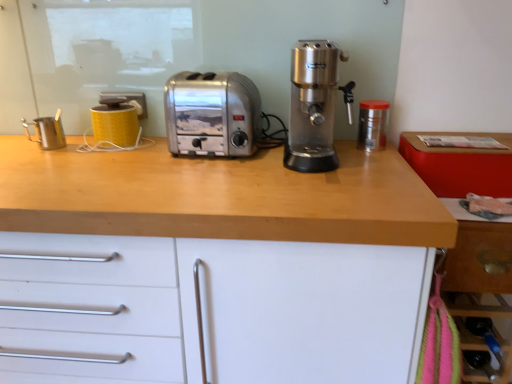
Describe the element at coordinates (212, 114) in the screenshot. I see `satin silver toaster at center` at that location.

What do you see at coordinates (209, 310) in the screenshot? I see `wooden countertop at center` at bounding box center [209, 310].

How much space does transparent plastic container at right, arranged as the 3th kitchen appliance when viewed from the left, occupy horizontally?

transparent plastic container at right, arranged as the 3th kitchen appliance when viewed from the left, is 4.26 inches in width.

Measure the distance between transparent plastic container at right, the 1th kitchen appliance in the right-to-left sequence, and camera.

transparent plastic container at right, the 1th kitchen appliance in the right-to-left sequence, and camera are 1.20 meters apart.

This screenshot has width=512, height=384. What do you see at coordinates (480, 259) in the screenshot?
I see `wooden drawer at lower right` at bounding box center [480, 259].

The width and height of the screenshot is (512, 384). I want to click on satin silver coffee machine at center, so click(x=314, y=106).

Could you measure the distance between satin silver toaster at center and transparent plastic container at right, arranged as the 3th kitchen appliance when viewed from the left?

satin silver toaster at center is 16.30 inches away from transparent plastic container at right, arranged as the 3th kitchen appliance when viewed from the left.

From a real-world perspective, is satin silver toaster at center physically above transparent plastic container at right, arranged as the 3th kitchen appliance when viewed from the left?

Yes, from a real-world perspective, satin silver toaster at center is on top of transparent plastic container at right, arranged as the 3th kitchen appliance when viewed from the left.

Is satin silver toaster at center positioned with its back to transparent plastic container at right, the 1th kitchen appliance in the right-to-left sequence?

No.

Can you confirm if satin silver toaster at center is thinner than transparent plastic container at right, arranged as the 3th kitchen appliance when viewed from the left?

No, satin silver toaster at center is not thinner than transparent plastic container at right, arranged as the 3th kitchen appliance when viewed from the left.

Which object is further away from the camera taking this photo, yellow matte mug at upper left, which is the 2th kitchen appliance in left-to-right order, or wooden countertop at center?

yellow matte mug at upper left, which is the 2th kitchen appliance in left-to-right order, is further away from the camera.

Is wooden countertop at center at the back of yellow matte mug at upper left, which is the 2th kitchen appliance in left-to-right order?

No, yellow matte mug at upper left, which is the 2th kitchen appliance in left-to-right order,'s orientation is not away from wooden countertop at center.

Who is taller, yellow matte mug at upper left, which ranks as the second kitchen appliance in right-to-left order, or wooden countertop at center?

With more height is wooden countertop at center.

From a real-world perspective, is yellow matte mug at upper left, which ranks as the second kitchen appliance in right-to-left order, above or below wooden countertop at center?

yellow matte mug at upper left, which ranks as the second kitchen appliance in right-to-left order, is situated higher than wooden countertop at center in the real world.

Is satin silver toaster at center to the left of yellow matte mug at upper left, which ranks as the second kitchen appliance in right-to-left order, from the viewer's perspective?

No.

Are satin silver toaster at center and yellow matte mug at upper left, which ranks as the second kitchen appliance in right-to-left order, making contact?

No, satin silver toaster at center is not beside yellow matte mug at upper left, which ranks as the second kitchen appliance in right-to-left order.

Is satin silver toaster at center in front of or behind yellow matte mug at upper left, which ranks as the second kitchen appliance in right-to-left order, in the image?

Clearly, satin silver toaster at center is in front of yellow matte mug at upper left, which ranks as the second kitchen appliance in right-to-left order.

In the scene shown: Between satin silver toaster at center and yellow matte mug at upper left, which ranks as the second kitchen appliance in right-to-left order, which one has larger size?

satin silver toaster at center is bigger.

Which is in front, yellow matte mug at upper left, which is the 2th kitchen appliance in left-to-right order, or transparent plastic container at right, arranged as the 3th kitchen appliance when viewed from the left?

transparent plastic container at right, arranged as the 3th kitchen appliance when viewed from the left, is more forward.

Between yellow matte mug at upper left, which is the 2th kitchen appliance in left-to-right order, and transparent plastic container at right, the 1th kitchen appliance in the right-to-left sequence, which one has larger width?

Wider between the two is yellow matte mug at upper left, which is the 2th kitchen appliance in left-to-right order.

From their relative heights in the image, would you say yellow matte mug at upper left, which is the 2th kitchen appliance in left-to-right order, is taller or shorter than transparent plastic container at right, the 1th kitchen appliance in the right-to-left sequence?

In the image, yellow matte mug at upper left, which is the 2th kitchen appliance in left-to-right order, appears to be taller than transparent plastic container at right, the 1th kitchen appliance in the right-to-left sequence.

Image resolution: width=512 pixels, height=384 pixels. In order to click on the 1st kitchen appliance below the yellow matte mug at upper left, which is the 2th kitchen appliance in left-to-right order (from a real-world perspective) in this screenshot , I will do `click(372, 125)`.

Does yellow matte mug at upper left, which is the 2th kitchen appliance in left-to-right order, appear on the left side of satin silver coffee machine at center?

Yes.

Which object is wider, yellow matte mug at upper left, which ranks as the second kitchen appliance in right-to-left order, or satin silver coffee machine at center?

With larger width is satin silver coffee machine at center.

Is yellow matte mug at upper left, which is the 2th kitchen appliance in left-to-right order, facing away from satin silver coffee machine at center?

No, yellow matte mug at upper left, which is the 2th kitchen appliance in left-to-right order,'s orientation is not away from satin silver coffee machine at center.

Is point (121, 145) positioned in front of point (291, 145)?

That is False.

Is wooden drawer at lower right facing away from transparent plastic container at right, arranged as the 3th kitchen appliance when viewed from the left?

That's not correct — wooden drawer at lower right is not looking away from transparent plastic container at right, arranged as the 3th kitchen appliance when viewed from the left.

Is wooden drawer at lower right in contact with transparent plastic container at right, arranged as the 3th kitchen appliance when viewed from the left?

No, wooden drawer at lower right is not making contact with transparent plastic container at right, arranged as the 3th kitchen appliance when viewed from the left.

From the image's perspective, would you say wooden drawer at lower right is shown under transparent plastic container at right, arranged as the 3th kitchen appliance when viewed from the left?

Indeed, from the image's perspective, wooden drawer at lower right is shown beneath transparent plastic container at right, arranged as the 3th kitchen appliance when viewed from the left.

Considering the sizes of objects wooden drawer at lower right and transparent plastic container at right, arranged as the 3th kitchen appliance when viewed from the left, in the image provided, who is wider, wooden drawer at lower right or transparent plastic container at right, arranged as the 3th kitchen appliance when viewed from the left,?

With larger width is wooden drawer at lower right.

Is metallic stainless steel pitcher at left, positioned as the third kitchen appliance in right-to-left order, smaller than wooden countertop at center?

Correct, metallic stainless steel pitcher at left, positioned as the third kitchen appliance in right-to-left order, occupies less space than wooden countertop at center.

From a real-world perspective, which is physically above, metallic stainless steel pitcher at left, which ranks as the first kitchen appliance in left-to-right order, or wooden countertop at center?

From a 3D spatial view, metallic stainless steel pitcher at left, which ranks as the first kitchen appliance in left-to-right order, is above.

From the image's perspective, between metallic stainless steel pitcher at left, positioned as the third kitchen appliance in right-to-left order, and wooden countertop at center, which one is located above?

metallic stainless steel pitcher at left, positioned as the third kitchen appliance in right-to-left order, appears higher in the image.

From the satin silver toaster at center, count 1st kitchen appliances backward and point to it. Please provide its 2D coordinates.

[(372, 125)]

Find the location of a particular element. cabinetry that appears below the yellow matte mug at upper left, which ranks as the second kitchen appliance in right-to-left order (from the image's perspective) is located at coordinates (209, 310).

Looking at the image, which one is located further to wooden countertop at center, wooden drawer at lower right or transparent plastic container at right, arranged as the 3th kitchen appliance when viewed from the left?

transparent plastic container at right, arranged as the 3th kitchen appliance when viewed from the left, lies further to wooden countertop at center than the other object.

Consider the image. When comparing their distances from yellow matte mug at upper left, which is the 2th kitchen appliance in left-to-right order, does satin silver toaster at center or wooden drawer at lower right seem closer?

satin silver toaster at center is closer to yellow matte mug at upper left, which is the 2th kitchen appliance in left-to-right order.

Looking at the image, which one is located closer to satin silver toaster at center, yellow matte mug at upper left, which ranks as the second kitchen appliance in right-to-left order, or wooden drawer at lower right?

Among the two, yellow matte mug at upper left, which ranks as the second kitchen appliance in right-to-left order, is located nearer to satin silver toaster at center.

Based on their spatial positions, is satin silver coffee machine at center or wooden countertop at center further from wooden drawer at lower right?

The object further to wooden drawer at lower right is wooden countertop at center.

When comparing their distances from satin silver toaster at center, does wooden drawer at lower right or satin silver coffee machine at center seem closer?

Among the two, satin silver coffee machine at center is located nearer to satin silver toaster at center.

Considering their positions, is satin silver toaster at center positioned closer to transparent plastic container at right, the 1th kitchen appliance in the right-to-left sequence, than metallic stainless steel pitcher at left, positioned as the third kitchen appliance in right-to-left order?

satin silver toaster at center is closer to transparent plastic container at right, the 1th kitchen appliance in the right-to-left sequence.

Based on their spatial positions, is metallic stainless steel pitcher at left, which ranks as the first kitchen appliance in left-to-right order, or satin silver coffee machine at center closer to satin silver toaster at center?

satin silver coffee machine at center lies closer to satin silver toaster at center than the other object.

From the image, which object appears to be nearer to satin silver toaster at center, wooden countertop at center or yellow matte mug at upper left, which ranks as the second kitchen appliance in right-to-left order?

yellow matte mug at upper left, which ranks as the second kitchen appliance in right-to-left order, lies closer to satin silver toaster at center than the other object.

This screenshot has height=384, width=512. Identify the location of coffee machine situated between wooden countertop at center and wooden drawer at lower right from left to right. (314, 106).

Image resolution: width=512 pixels, height=384 pixels. In order to click on kitchen appliance between satin silver coffee machine at center and wooden drawer at lower right in this screenshot , I will do `click(372, 125)`.

You are a GUI agent. You are given a task and a screenshot of the screen. Output one action in this format:
    pyautogui.click(x=<x>, y=<y>)
    Task: Click on the kitchen appliance located between metallic stainless steel pitcher at left, which ranks as the first kitchen appliance in left-to-right order, and transparent plastic container at right, the 1th kitchen appliance in the right-to-left sequence, in the left-right direction
    
    Given the screenshot: What is the action you would take?
    pyautogui.click(x=116, y=121)

Locate an element on the screen. Image resolution: width=512 pixels, height=384 pixels. kitchen appliance situated between wooden countertop at center and wooden drawer at lower right from left to right is located at coordinates (372, 125).